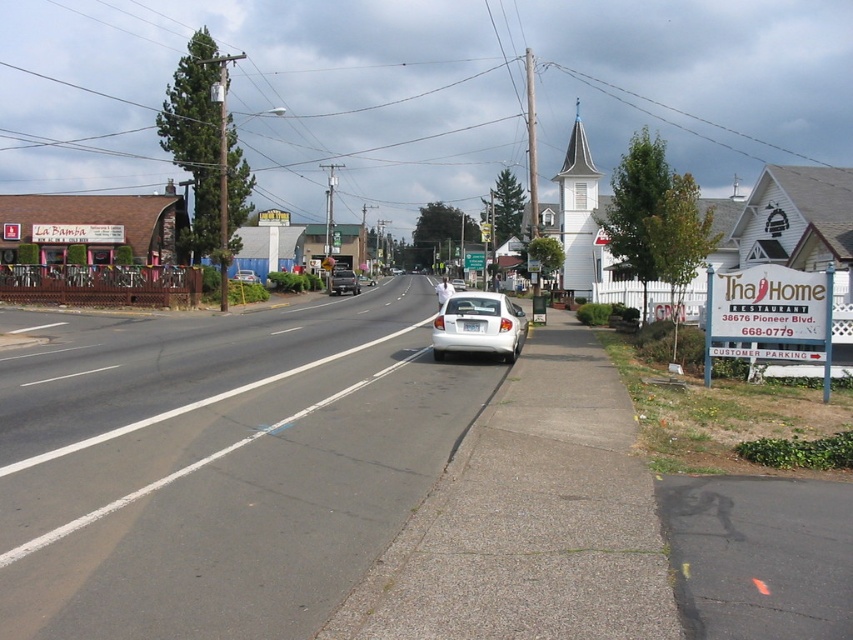
Question: Is white wood spire at upper right wider than matte silver sedan at center?

Choices:
 (A) no
 (B) yes

Answer: (B)

Question: Which point appears farthest from the camera in this image?

Choices:
 (A) (250, 273)
 (B) (459, 289)
 (C) (589, 288)
 (D) (462, 296)

Answer: (B)

Question: Does white plastic sign at right lie behind matte silver sedan at center?

Choices:
 (A) no
 (B) yes

Answer: (A)

Question: Estimate the real-world distances between objects in this image. Which object is farther from the white wood spire at upper right?

Choices:
 (A) white glossy sedan at center
 (B) white matte car at center
 (C) white plastic sign at right
 (D) matte silver sedan at center

Answer: (A)

Question: Does white wood spire at upper right appear on the left side of matte silver sedan at center?

Choices:
 (A) no
 (B) yes

Answer: (A)

Question: Estimate the real-world distances between objects in this image. Which object is closer to the white matte car at center?

Choices:
 (A) white wood spire at upper right
 (B) white plastic sign at right
 (C) white matte sedan at center
 (D) matte silver sedan at center

Answer: (B)